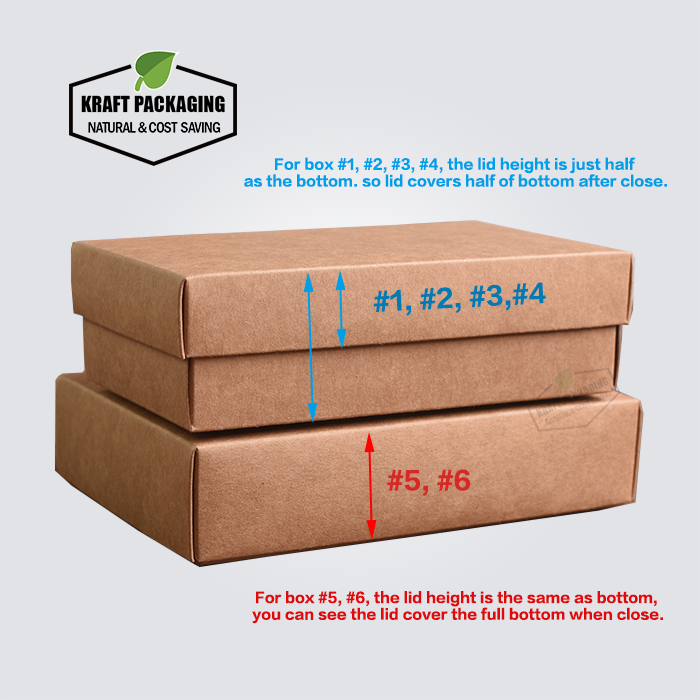
Identify the location of brown cardboard boxes. (388, 374), (278, 510).